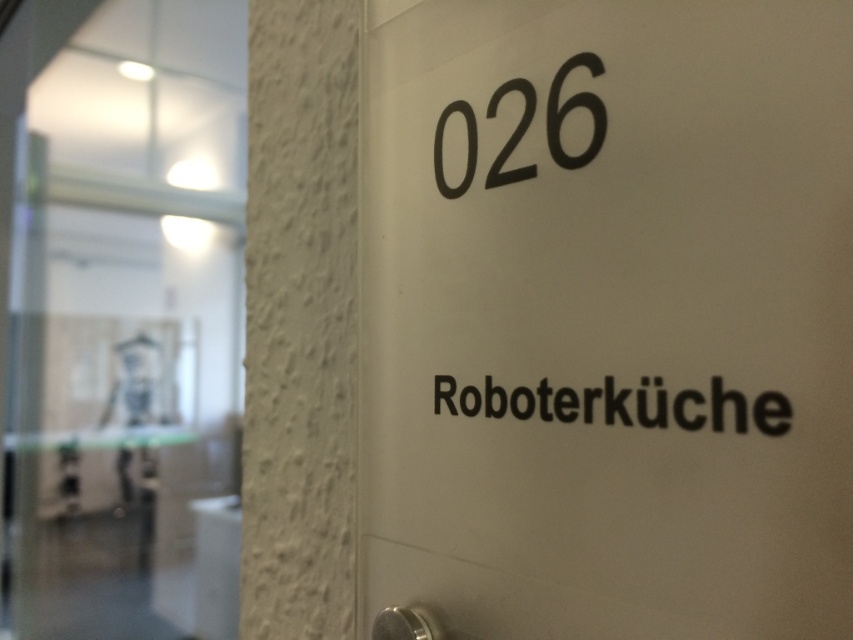
Between white matte sign at center and black matte text at center, which one appears on the right side from the viewer's perspective?

From the viewer's perspective, black matte text at center appears more on the right side.

Find the location of a particular element. The image size is (853, 640). white matte sign at center is located at coordinates (607, 317).

Can you confirm if black matte text at center is positioned above black matte number at upper center?

Incorrect, black matte text at center is not positioned above black matte number at upper center.

Which of these two, black matte text at center or black matte number at upper center, stands shorter?

black matte text at center is shorter.

Which is behind, point (711, 378) or point (462, 186)?

Point (462, 186)

Image resolution: width=853 pixels, height=640 pixels. I want to click on black matte text at center, so click(x=619, y=404).

Which is in front, point (682, 278) or point (567, 106)?

Point (682, 278)

This screenshot has height=640, width=853. In order to click on white matte sign at center in this screenshot , I will do `click(607, 317)`.

What do you see at coordinates (607, 317) in the screenshot?
I see `white matte sign at center` at bounding box center [607, 317].

Find the location of a particular element. white matte sign at center is located at coordinates (607, 317).